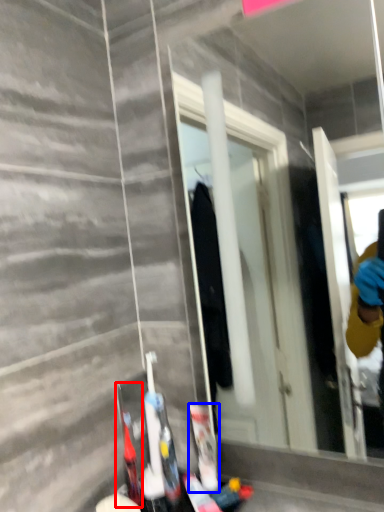
Question: Which object appears closest to the camera in this image, toiletry (highlighted by a red box) or toiletry (highlighted by a blue box)?

Choices:
 (A) toiletry
 (B) toiletry

Answer: (A)